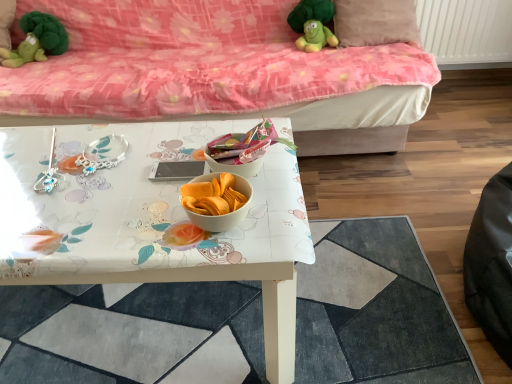
Describe the element at coordinates (132, 333) in the screenshot. I see `white glossy table at center` at that location.

In order to face white glossy table at center, should I rotate leftwards or rightwards?

To align with it, rotate left about 0.194°.

What do you see at coordinates (375, 22) in the screenshot? I see `peachy soft pillow at upper right` at bounding box center [375, 22].

Describe the element at coordinates (227, 69) in the screenshot. I see `velvet pink couch at upper center` at that location.

Locate an element on the screen. white glossy table at center is located at coordinates (132, 333).

Is green plush toy at upper center, the 2th toy when ordered from left to right, in contact with white glossy table at center?

No, green plush toy at upper center, the 2th toy when ordered from left to right, is not making contact with white glossy table at center.

From the image's perspective, between green plush toy at upper center, the first toy in the right-to-left sequence, and white glossy table at center, which one is located above?

green plush toy at upper center, the first toy in the right-to-left sequence, appears higher in the image.

How different are the orientations of green plush toy at upper center, the first toy in the right-to-left sequence, and white glossy table at center in degrees?

94.3 degrees separate the facing orientations of green plush toy at upper center, the first toy in the right-to-left sequence, and white glossy table at center.

Between point (298, 47) and point (230, 121), which one is positioned behind?

Positioned behind is point (298, 47).

Consider the image. Could you tell me if green plush toy at upper left, which is the first toy in left-to-right order, is facing white glossy table at center?

Yes, green plush toy at upper left, which is the first toy in left-to-right order, is turned towards white glossy table at center.

Are green plush toy at upper left, the 2th toy when ordered from right to left, and white glossy table at center making contact?

There is a gap between green plush toy at upper left, the 2th toy when ordered from right to left, and white glossy table at center.

How different are the orientations of green plush toy at upper left, which is the first toy in left-to-right order, and white glossy table at center in degrees?

The angular difference between green plush toy at upper left, which is the first toy in left-to-right order, and white glossy table at center is 94.3 degrees.

Where is `table that appears below the green plush toy at upper left, which is the first toy in left-to-right order (from a real-world perspective)`? This screenshot has height=384, width=512. table that appears below the green plush toy at upper left, which is the first toy in left-to-right order (from a real-world perspective) is located at coordinates (155, 221).

This screenshot has height=384, width=512. In order to click on toy behind the peachy soft pillow at upper right in this screenshot , I will do `click(36, 40)`.

Is point (369, 27) farther from viewer compared to point (41, 22)?

No.

Which is in front, peachy soft pillow at upper right or green plush toy at upper left, which is the first toy in left-to-right order?

peachy soft pillow at upper right is in front.

From a real-world perspective, is green plush toy at upper left, which is the first toy in left-to-right order, above or below green plush toy at upper center, the 2th toy when ordered from left to right?

green plush toy at upper left, which is the first toy in left-to-right order, is below green plush toy at upper center, the 2th toy when ordered from left to right.

Considering the relative positions of green plush toy at upper left, the 2th toy when ordered from right to left, and green plush toy at upper center, the first toy in the right-to-left sequence, in the image provided, is green plush toy at upper left, the 2th toy when ordered from right to left, to the left or to the right of green plush toy at upper center, the first toy in the right-to-left sequence,?

From the image, it's evident that green plush toy at upper left, the 2th toy when ordered from right to left, is to the left of green plush toy at upper center, the first toy in the right-to-left sequence.

From the image's perspective, which object appears higher, green plush toy at upper left, the 2th toy when ordered from right to left, or green plush toy at upper center, the first toy in the right-to-left sequence?

From the image's view, green plush toy at upper center, the first toy in the right-to-left sequence, is above.

Does point (17, 57) lie in front of point (325, 39)?

Yes, point (17, 57) is in front of point (325, 39).

How distant is peachy soft pillow at upper right from white glossy table at center?

A: peachy soft pillow at upper right is 1.03 meters away from white glossy table at center.

Between peachy soft pillow at upper right and white glossy table at center, which one has smaller size?

With smaller size is white glossy table at center.

Is peachy soft pillow at upper right located outside white glossy table at center?

Yes, peachy soft pillow at upper right is not within white glossy table at center.

Which object is positioned more to the right, peachy soft pillow at upper right or white glossy table at center?

From the viewer's perspective, peachy soft pillow at upper right appears more on the right side.

From the image's perspective, which object appears higher, velvet pink couch at upper center or green plush toy at upper center, the first toy in the right-to-left sequence?

green plush toy at upper center, the first toy in the right-to-left sequence, appears higher in the image.

In the image, is velvet pink couch at upper center on the left side or the right side of green plush toy at upper center, the first toy in the right-to-left sequence?

In the image, velvet pink couch at upper center appears on the left side of green plush toy at upper center, the first toy in the right-to-left sequence.

Which object is further away from the camera taking this photo, velvet pink couch at upper center or green plush toy at upper center, the first toy in the right-to-left sequence?

green plush toy at upper center, the first toy in the right-to-left sequence, is further from the camera.

Choose the correct answer: Is velvet pink couch at upper center inside green plush toy at upper center, the 2th toy when ordered from left to right, or outside it?

velvet pink couch at upper center cannot be found inside green plush toy at upper center, the 2th toy when ordered from left to right.

Could you tell me if green plush toy at upper center, the first toy in the right-to-left sequence, is facing green plush toy at upper left, which is the first toy in left-to-right order?

No, green plush toy at upper center, the first toy in the right-to-left sequence, does not turn towards green plush toy at upper left, which is the first toy in left-to-right order.

Is point (330, 44) closer to viewer compared to point (35, 18)?

Yes, it is.

Are green plush toy at upper center, the first toy in the right-to-left sequence, and green plush toy at upper left, which is the first toy in left-to-right order, located far from each other?

That's right, there is a large distance between green plush toy at upper center, the first toy in the right-to-left sequence, and green plush toy at upper left, which is the first toy in left-to-right order.

Considering the sizes of objects green plush toy at upper center, the first toy in the right-to-left sequence, and green plush toy at upper left, which is the first toy in left-to-right order, in the image provided, who is shorter, green plush toy at upper center, the first toy in the right-to-left sequence, or green plush toy at upper left, which is the first toy in left-to-right order,?

With less height is green plush toy at upper center, the first toy in the right-to-left sequence.

Find the location of a particular element. the 1st toy behind the white glossy table at center, starting your count from the anchor is located at coordinates (313, 24).

Where is `table on the right of green plush toy at upper left, the 2th toy when ordered from right to left`? table on the right of green plush toy at upper left, the 2th toy when ordered from right to left is located at coordinates (155, 221).

Estimate the real-world distances between objects in this image. Which object is closer to white glossy table at center, green plush toy at upper center, the 2th toy when ordered from left to right, or peachy soft pillow at upper right?

green plush toy at upper center, the 2th toy when ordered from left to right, is closer to white glossy table at center.

From the image, which object appears to be nearer to green plush toy at upper center, the 2th toy when ordered from left to right, green plush toy at upper left, the 2th toy when ordered from right to left, or peachy soft pillow at upper right?

peachy soft pillow at upper right.

When comparing their distances from velvet pink couch at upper center, does green plush toy at upper left, which is the first toy in left-to-right order, or green plush toy at upper center, the 2th toy when ordered from left to right, seem further?

green plush toy at upper left, which is the first toy in left-to-right order, is positioned further to the anchor velvet pink couch at upper center.

Which object lies further to the anchor point white glossy table at center, white glossy table at center or green plush toy at upper left, which is the first toy in left-to-right order?

Based on the image, green plush toy at upper left, which is the first toy in left-to-right order, appears to be further to white glossy table at center.

Estimate the real-world distances between objects in this image. Which object is further from green plush toy at upper center, the 2th toy when ordered from left to right, peachy soft pillow at upper right or velvet pink couch at upper center?

The object further to green plush toy at upper center, the 2th toy when ordered from left to right, is velvet pink couch at upper center.

Looking at this image, looking at the image, which one is located further to velvet pink couch at upper center, green plush toy at upper center, the 2th toy when ordered from left to right, or white glossy table at center?

white glossy table at center.

When comparing their distances from peachy soft pillow at upper right, does green plush toy at upper left, the 2th toy when ordered from right to left, or white glossy table at center seem closer?

The object closer to peachy soft pillow at upper right is white glossy table at center.

Considering their positions, is white glossy table at center positioned further to white glossy table at center than peachy soft pillow at upper right?

peachy soft pillow at upper right lies further to white glossy table at center than the other object.

Image resolution: width=512 pixels, height=384 pixels. I want to click on toy located between green plush toy at upper left, the 2th toy when ordered from right to left, and peachy soft pillow at upper right in the left-right direction, so click(313, 24).

Locate an element on the screen. The width and height of the screenshot is (512, 384). studio couch between green plush toy at upper center, the first toy in the right-to-left sequence, and white glossy table at center from top to bottom is located at coordinates (227, 69).

Where is `studio couch between green plush toy at upper left, which is the first toy in left-to-right order, and green plush toy at upper center, the first toy in the right-to-left sequence`? studio couch between green plush toy at upper left, which is the first toy in left-to-right order, and green plush toy at upper center, the first toy in the right-to-left sequence is located at coordinates (227, 69).

This screenshot has width=512, height=384. What are the coordinates of `table between green plush toy at upper left, which is the first toy in left-to-right order, and white glossy table at center, in the vertical direction` in the screenshot? It's located at [x=155, y=221].